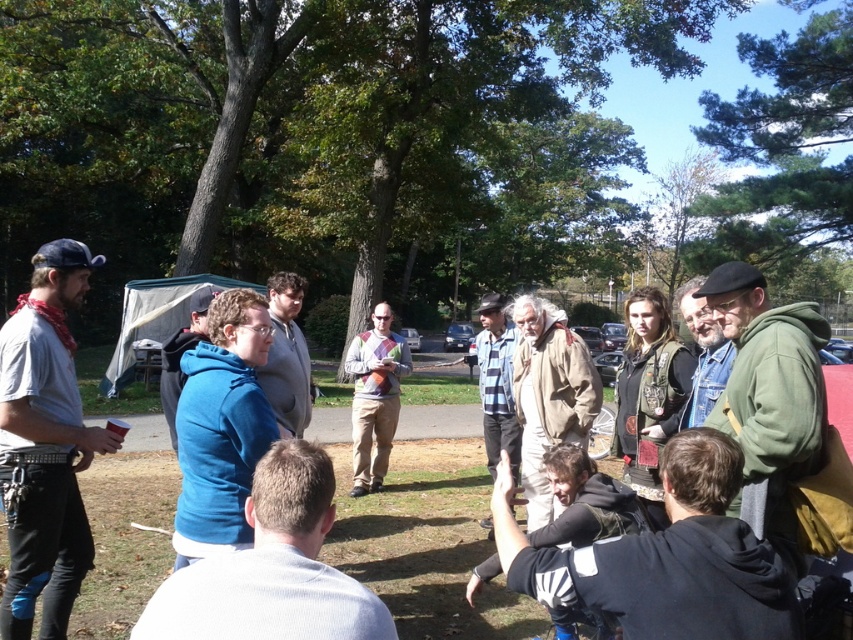
You are standing in the park scene and want to walk towards the two points marked in the image. Which point, point (793, 330) or point (364, 452), will you reach first?

Point (793, 330) is closer to the viewer than point (364, 452), so you will reach point (793, 330) first.

You are standing in the park and see the dark brown leather jacket at lower right and the denim shirt at left. Which clothing item is nearer to you?

The dark brown leather jacket at lower right is closer to the viewer than the denim shirt at left.

Looking at this image, you are standing in the park and see the group of people. There is a point marked at coordinate (769, 396). Which object from the group is located at that point?

The point at coordinate (769, 396) indicates the green fleece jacket at right.